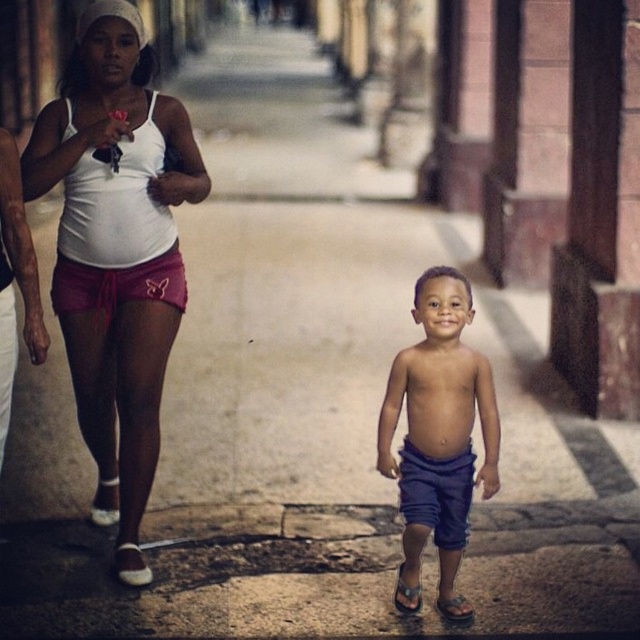
Question: Among these points, which one is nearest to the camera?

Choices:
 (A) (1, 250)
 (B) (449, 545)

Answer: (A)

Question: Is blue denim shorts at center bigger than smooth skin torso at center?

Choices:
 (A) no
 (B) yes

Answer: (B)

Question: Is white matte tank top at upper left wider than smooth skin torso at center?

Choices:
 (A) no
 (B) yes

Answer: (B)

Question: Estimate the real-world distances between objects in this image. Which object is closer to the blue denim shorts at center?

Choices:
 (A) white matte tank top at upper left
 (B) smooth skin torso at center

Answer: (A)

Question: Which object appears farthest from the camera in this image?

Choices:
 (A) white matte tank top at upper left
 (B) smooth skin torso at center

Answer: (A)

Question: Considering the relative positions of white matte tank top at upper left and blue denim shorts at center in the image provided, where is white matte tank top at upper left located with respect to blue denim shorts at center?

Choices:
 (A) left
 (B) right

Answer: (A)